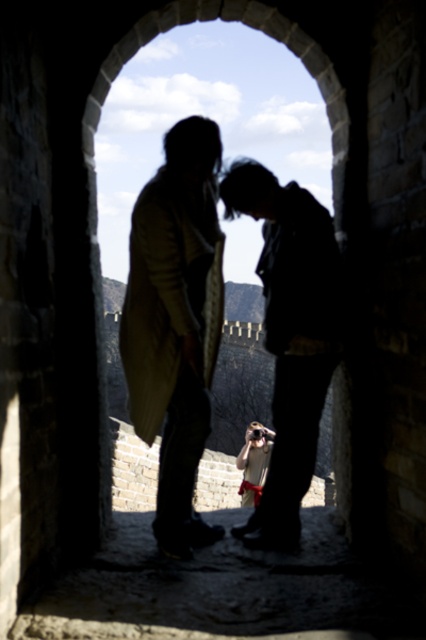
The image size is (426, 640). Find the location of `silhouette clothing at center`. silhouette clothing at center is located at coordinates (175, 323).

Does silhouette clothing at center appear on the left side of matte black jacket at center?

Indeed, silhouette clothing at center is positioned on the left side of matte black jacket at center.

Identify the location of silhouette clothing at center. coord(175,323).

Is point (213, 134) farther from viewer compared to point (307, 234)?

Yes, it is.

Find the location of a particular element. silhouette coat at center is located at coordinates (175, 323).

Find the location of a particular element. silhouette coat at center is located at coordinates (175, 323).

Can you confirm if silhouette clothing at center is taller than silhouette coat at center?

Incorrect, silhouette clothing at center's height is not larger of silhouette coat at center's.

Does silhouette clothing at center appear over silhouette coat at center?

Incorrect, silhouette clothing at center is not positioned above silhouette coat at center.

In order to click on silhouette clothing at center in this screenshot , I will do `click(175, 323)`.